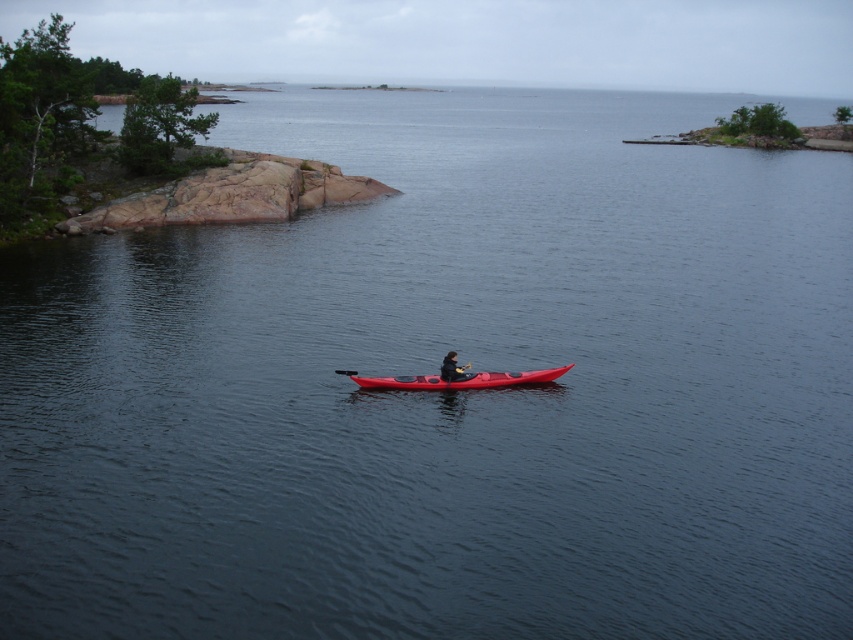
Question: Is matte red kayak at center smaller than matte red canoe at center?

Choices:
 (A) no
 (B) yes

Answer: (A)

Question: In this image, where is matte red canoe at center located relative to dark gray fabric jacket at center?

Choices:
 (A) right
 (B) left

Answer: (A)

Question: Is matte red canoe at center closer to camera compared to dark gray fabric jacket at center?

Choices:
 (A) no
 (B) yes

Answer: (A)

Question: Which point is closer to the camera?

Choices:
 (A) matte red canoe at center
 (B) dark gray fabric jacket at center
 (C) matte red kayak at center

Answer: (B)

Question: Which object appears farthest from the camera in this image?

Choices:
 (A) matte red kayak at center
 (B) matte red canoe at center

Answer: (B)

Question: Based on their relative distances, which object is farther from the dark gray fabric jacket at center?

Choices:
 (A) matte red kayak at center
 (B) matte red canoe at center

Answer: (B)